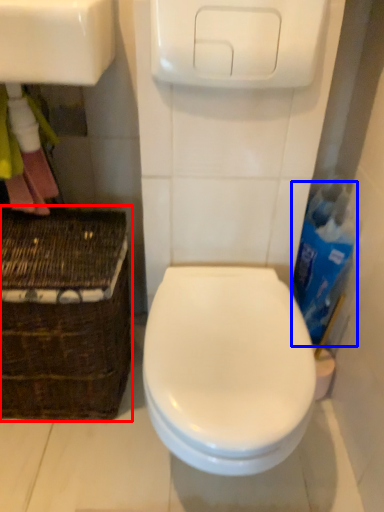
Question: Which of the following is the closest to the observer, basket (highlighted by a red box) or cleaning product (highlighted by a blue box)?

Choices:
 (A) basket
 (B) cleaning product

Answer: (A)